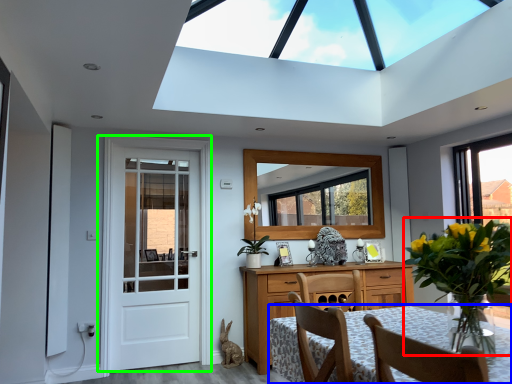
Question: Which object is positioned farthest from floral arrangement (highlighted by a red box)? Select from table (highlighted by a blue box) and door (highlighted by a green box).

Choices:
 (A) table
 (B) door

Answer: (B)